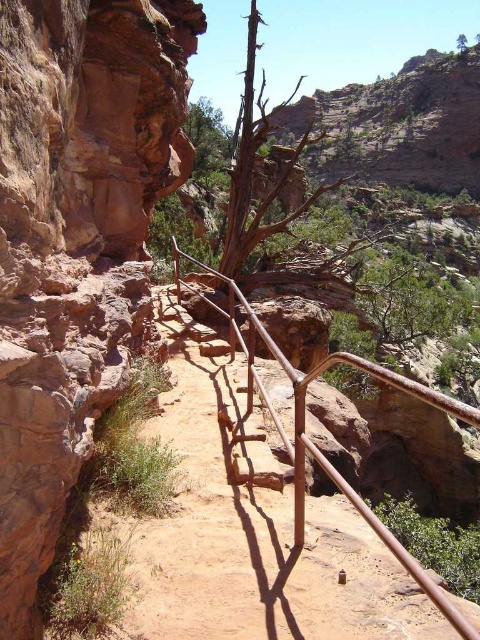
You are a hiker carrying a backpack and need to cross the narrow path between the rustic stone cliff at left and the rusty metal rail at center. Your backpack has a width of 0.5 meters. Can you safely pass through the path without touching either the cliff or the rail?

The distance between the rustic stone cliff at left and the rusty metal rail at center is 7.27 meters. Since your backpack is only 0.5 meters wide, there is ample space to pass safely without touching either side.

You are a hiker planning to take a photo of the rustic stone cliff at left and the rusty metal rail at center. If you want to capture both objects in the frame without moving your camera, which object should you position closer to the edge of the frame to ensure the other fits entirely?

Since the rustic stone cliff at left is narrower than the rusty metal rail at center, you should position the rustic stone cliff at left closer to the edge of the frame. This allows the wider rusty metal rail at center to fit entirely within the camera frame.